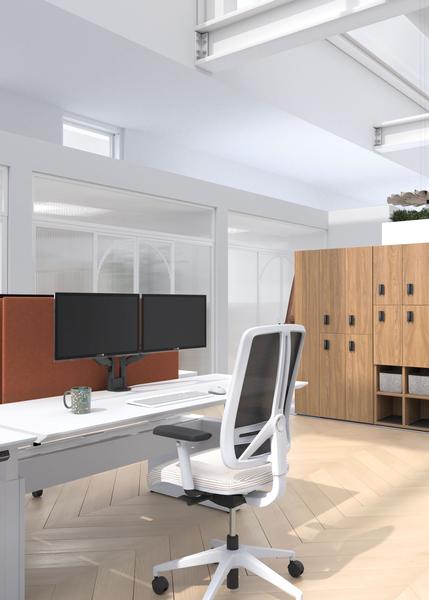
This screenshot has width=429, height=600. I want to click on monitor, so click(x=101, y=327), click(x=169, y=328).